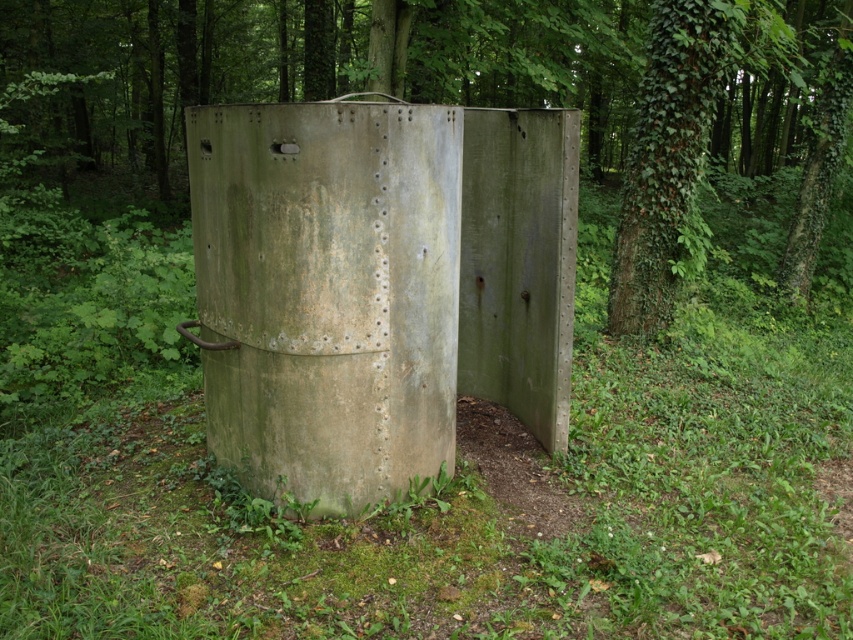
You are a hiker navigating through the forest and come across the green matte bunker at center. Based on its location coordinates, can you determine if it is positioned closer to the northern or southern part of the forest area?

The green matte bunker at center is located at coordinates point (x=378, y=284). Since both coordinates are nearly equal, it is positioned near the center of the forest area, neither closer to the northern nor southern part.